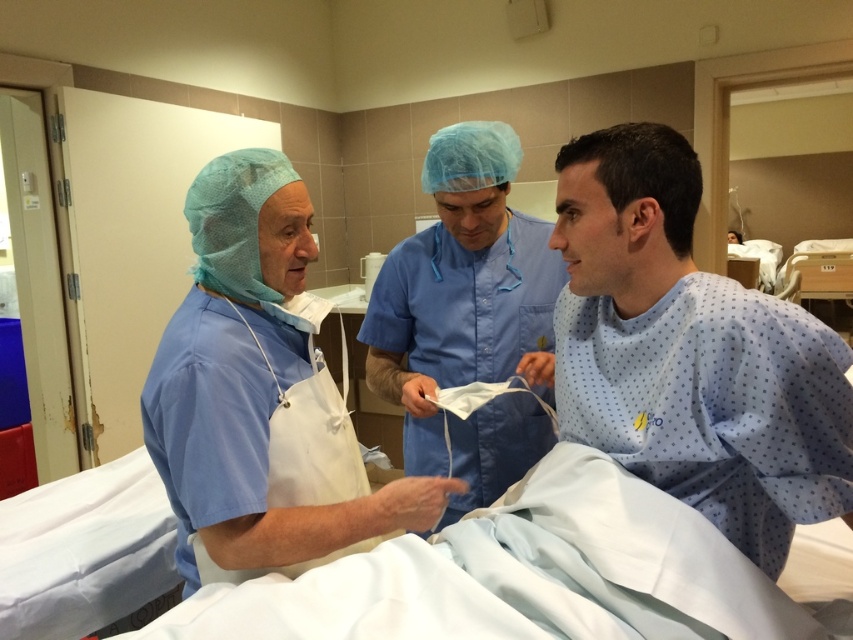
You are a patient in the hospital bed and want to hand a note to the healthcare professional wearing blue smooth scrubs at left. Can you reach them directly without getting out of the white fabric hospital bed at center?

The white fabric hospital bed at center is closer to the viewer than the blue smooth scrubs at left, so you can reach the healthcare professional wearing blue smooth scrubs at left directly without getting out of the bed.

In the medical scene, there are two points marked as point 1 at coordinates (820, 364) and point 2 at coordinates (277, 584). From the perspective of someone standing at point 1, which direction would point 2 be located relative to them?

Point 2 at coordinates (277, 584) is behind point 1 at coordinates (820, 364), so from the perspective of someone standing at point 1, point 2 would be located behind them.

You are a healthcare worker in the scene and need to choose between the light blue fabric at center and the blue smooth scrubs at center for a task that requires a larger item. Which one should you choose?

The blue smooth scrubs at center should be chosen because it is larger than the light blue fabric at center.